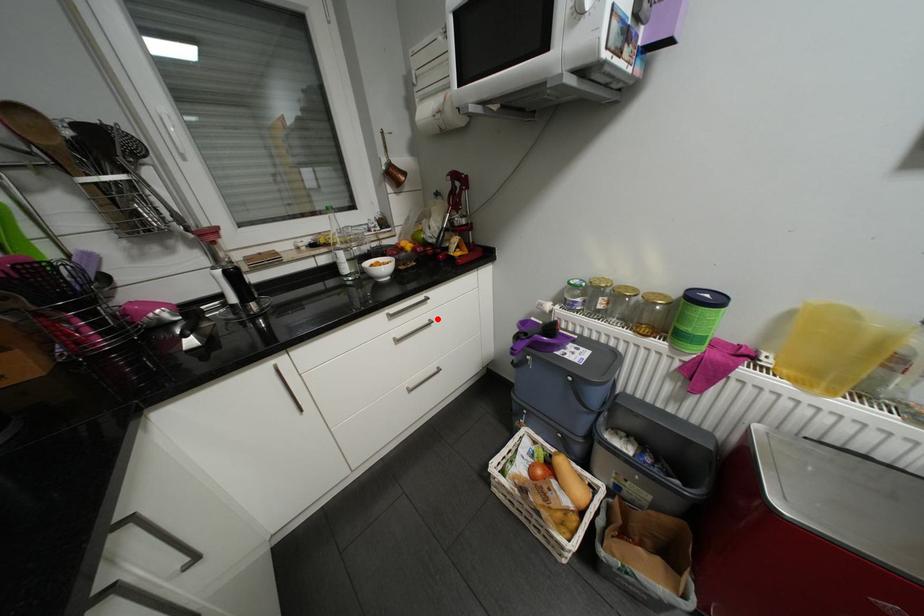
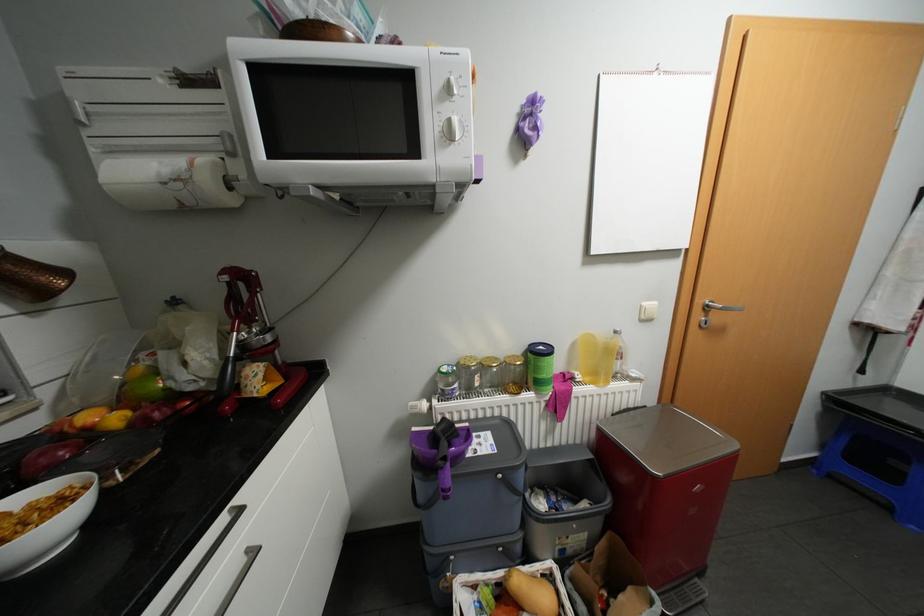
Question: I am providing you with two images of the same scene from different viewpoints. A red point is marked on the first image. Can you still see the location of the red point in image 2?

Choices:
 (A) Yes
 (B) No

Answer: (A)